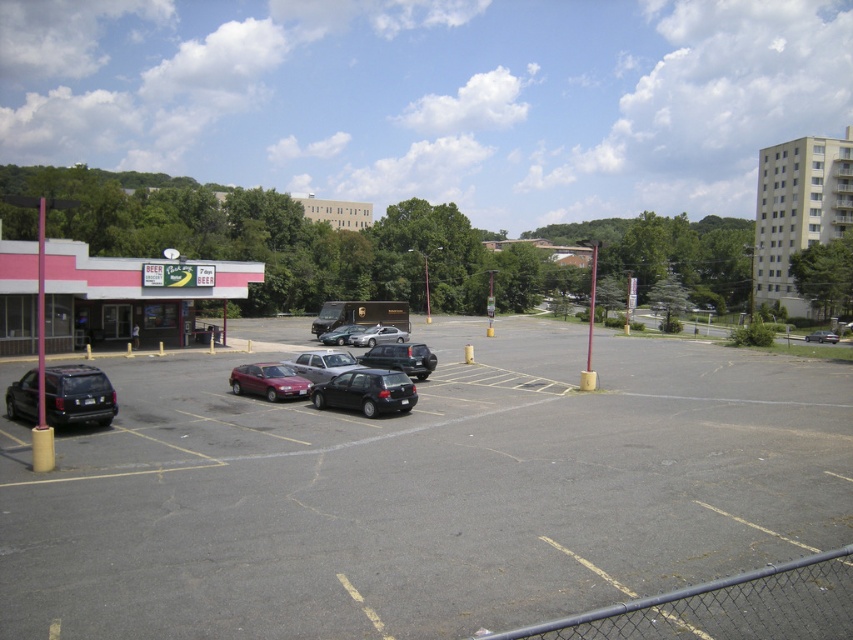
Consider the image. Can you confirm if black matte hatchback at center is positioned above matte black van at center?

Incorrect, black matte hatchback at center is not positioned above matte black van at center.

Is black matte hatchback at center positioned before matte black van at center?

Yes.

The image size is (853, 640). Describe the element at coordinates (366, 392) in the screenshot. I see `black matte hatchback at center` at that location.

Find the location of a particular element. This screenshot has height=640, width=853. black matte hatchback at center is located at coordinates (366, 392).

Can you confirm if maroon metallic hatchback at center is taller than shiny black sedan at center?

In fact, maroon metallic hatchback at center may be shorter than shiny black sedan at center.

Is the position of maroon metallic hatchback at center less distant than that of shiny black sedan at center?

Yes, maroon metallic hatchback at center is closer to the viewer.

Between point (250, 380) and point (364, 353), which one is positioned behind?

Positioned behind is point (364, 353).

Where is `maroon metallic hatchback at center`? The height and width of the screenshot is (640, 853). maroon metallic hatchback at center is located at coordinates (267, 380).

Is dark gray asphalt parking lot at center bigger than matte black van at center?

Correct, dark gray asphalt parking lot at center is larger in size than matte black van at center.

Does dark gray asphalt parking lot at center appear on the left side of matte black van at center?

Incorrect, dark gray asphalt parking lot at center is not on the left side of matte black van at center.

The width and height of the screenshot is (853, 640). Describe the element at coordinates (422, 490) in the screenshot. I see `dark gray asphalt parking lot at center` at that location.

Where is `dark gray asphalt parking lot at center`? dark gray asphalt parking lot at center is located at coordinates (422, 490).